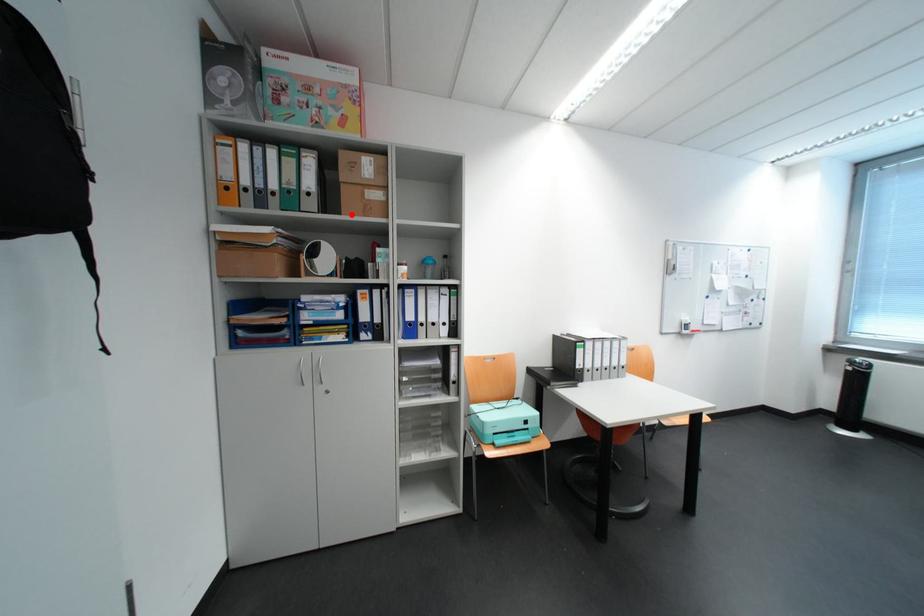
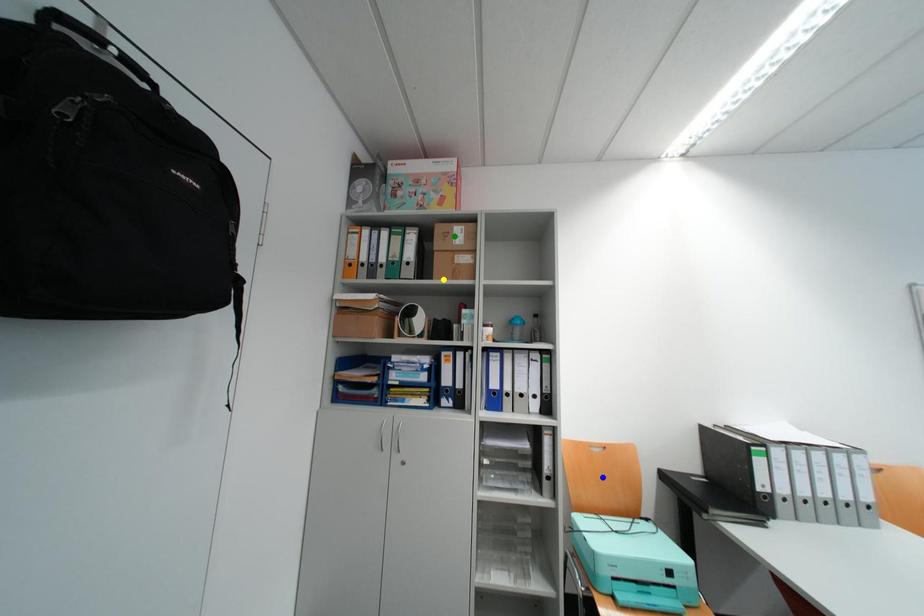
Question: I am providing you with two images of the same scene from different viewpoints. A red point is marked on the first image. You are given multiple points on the second image. Which mark in image 2 goes with the point in image 1?

Choices:
 (A) yellow point
 (B) green point
 (C) blue point

Answer: (A)